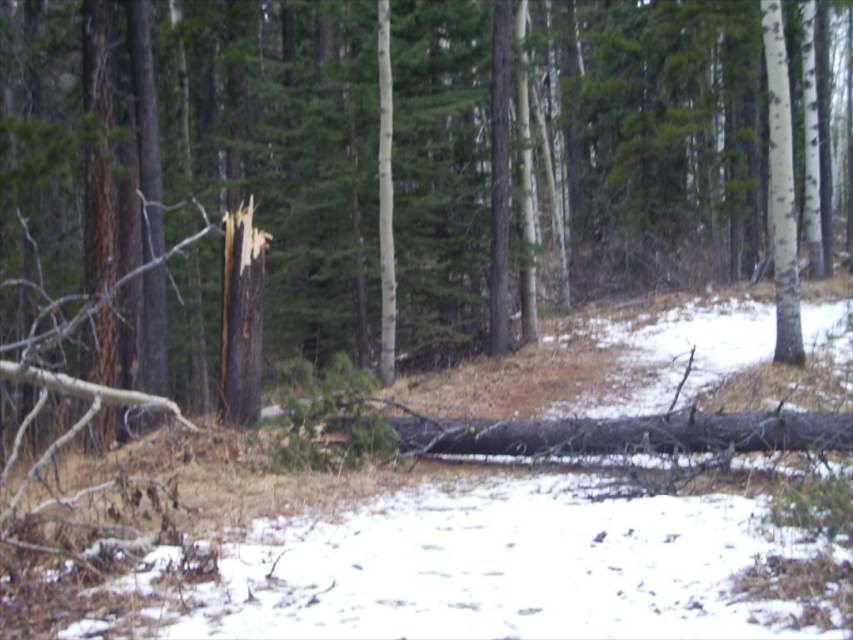
Consider the image. Which is more to the right, dark brown bark at center or dark brown wood at center?

dark brown bark at center

Between dark brown bark at center and dark brown wood at center, which one has less height?

With less height is dark brown wood at center.

Who is more distant from viewer, (431, 147) or (225, 419)?

Positioned behind is point (431, 147).

This screenshot has height=640, width=853. I want to click on dark brown bark at center, so click(657, 134).